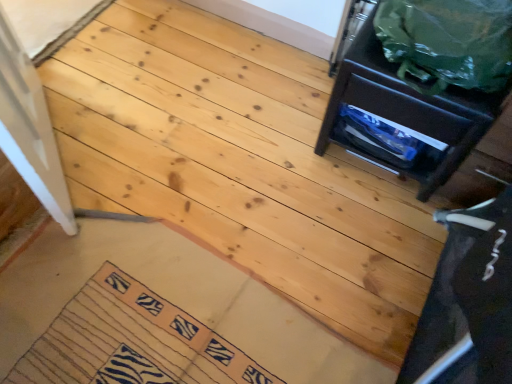
You are a GUI agent. You are given a task and a screenshot of the screen. Output one action in this format:
    pyautogui.click(x=<x>, y=<y>)
    Task: Click on the vacant space situated above zebra-patterned fabric mat at lower left (from a real-world perspective)
    This screenshot has width=512, height=384.
    Given the screenshot: What is the action you would take?
    point(125,347)